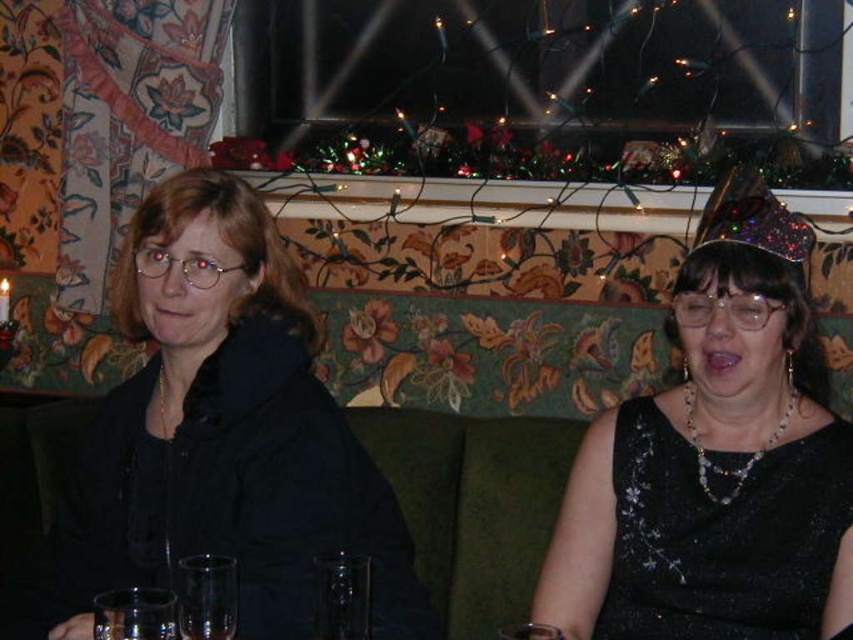
You are standing in front of the sofa and want to place a small decoration on the sofa. You have two points to choose from, point (788, 557) and point (344, 554). Which point is closer to you?

Point (788, 557) is further to the viewer than point (344, 554), so the point closer to you is point (344, 554).

Based on the photo, you are a photographer setting up for a group photo. You need to place a small microphone stand between the transparent glass at center and the clear glass wine glass at lower center so it doesn

The transparent glass at center is closer to you than the clear glass wine glass at lower center, so place the microphone stand between them by positioning it closer to the clear glass wine glass at lower center to avoid blocking the transparent glass at center.

You are a photographer trying to capture the perfect shot of the black sequined dress at center. The dress is represented by the point at coordinates [714,461]. If you want to ensure the dress is centered in your photo, where should you position your camera relative to the current view?

The black sequined dress at center is already positioned at the coordinates [714,461], so to center it in the photo, the camera should remain aligned with those coordinates.